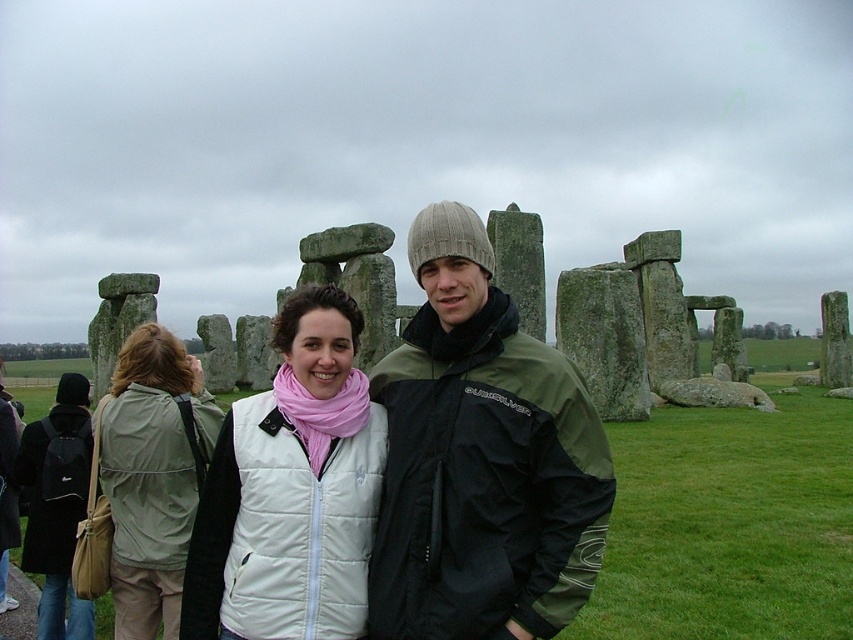
Question: Is white puffy vest at center bigger than light beige fabric jacket at lower left?

Choices:
 (A) no
 (B) yes

Answer: (A)

Question: Which object is positioned farthest from the white puffy vest at center?

Choices:
 (A) light beige fabric jacket at lower left
 (B) olive-green/black jacket at center

Answer: (A)

Question: Estimate the real-world distances between objects in this image. Which object is closer to the white puffy vest at center?

Choices:
 (A) light beige fabric jacket at lower left
 (B) olive-green/black jacket at center

Answer: (B)

Question: Considering the relative positions of white puffy vest at center and light beige fabric jacket at lower left in the image provided, where is white puffy vest at center located with respect to light beige fabric jacket at lower left?

Choices:
 (A) below
 (B) above

Answer: (B)

Question: Which point is closer to the camera taking this photo?

Choices:
 (A) (358, 426)
 (B) (445, 385)
 (C) (117, 476)

Answer: (B)

Question: From the image, what is the correct spatial relationship of olive-green/black jacket at center in relation to white puffy vest at center?

Choices:
 (A) above
 (B) below

Answer: (B)